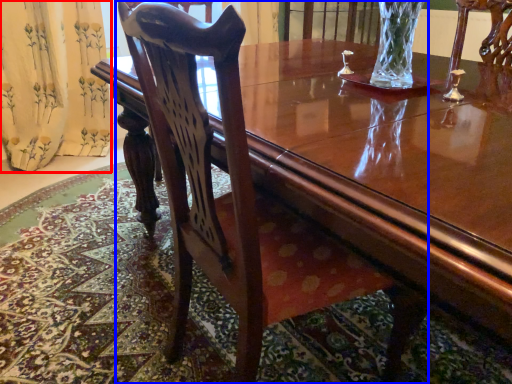
Question: Which object appears closest to the camera in this image, curtain (highlighted by a red box) or chair (highlighted by a blue box)?

Choices:
 (A) curtain
 (B) chair

Answer: (B)